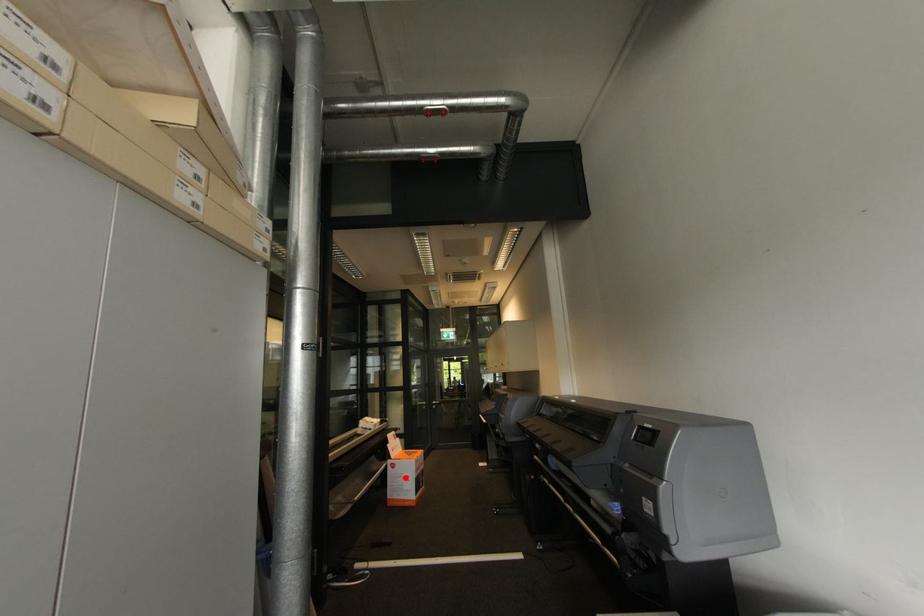
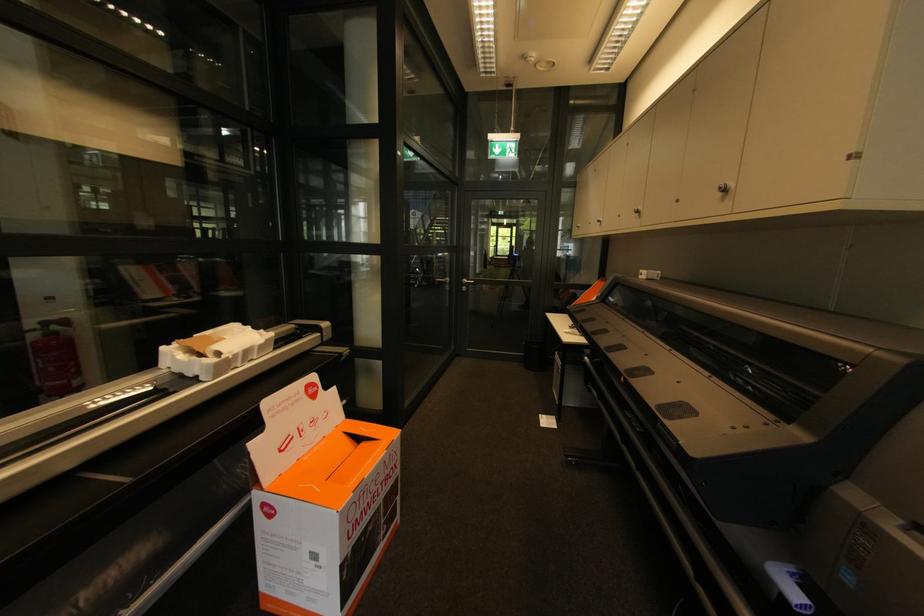
In the second image, find the point that corresponds to the highlighted location in the first image.

(299, 549)